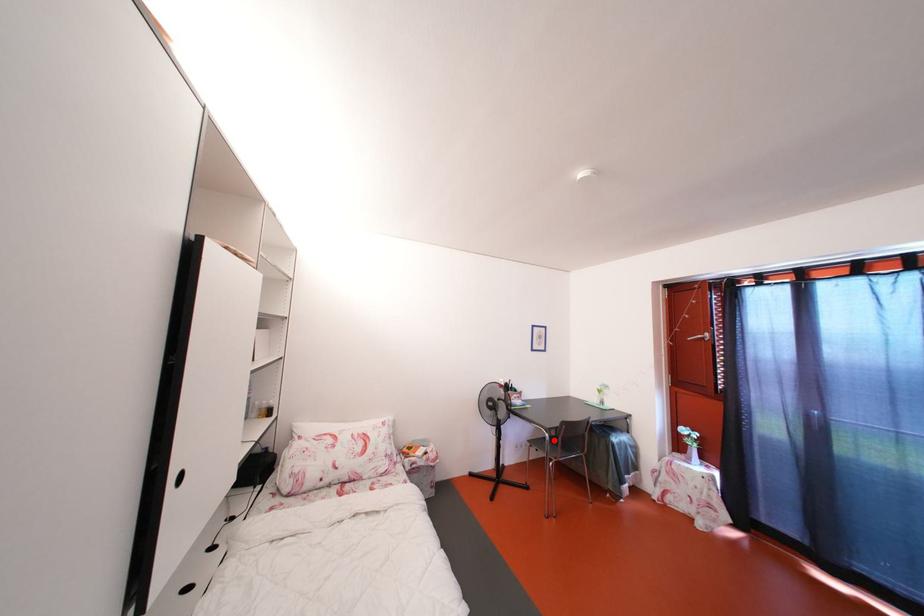
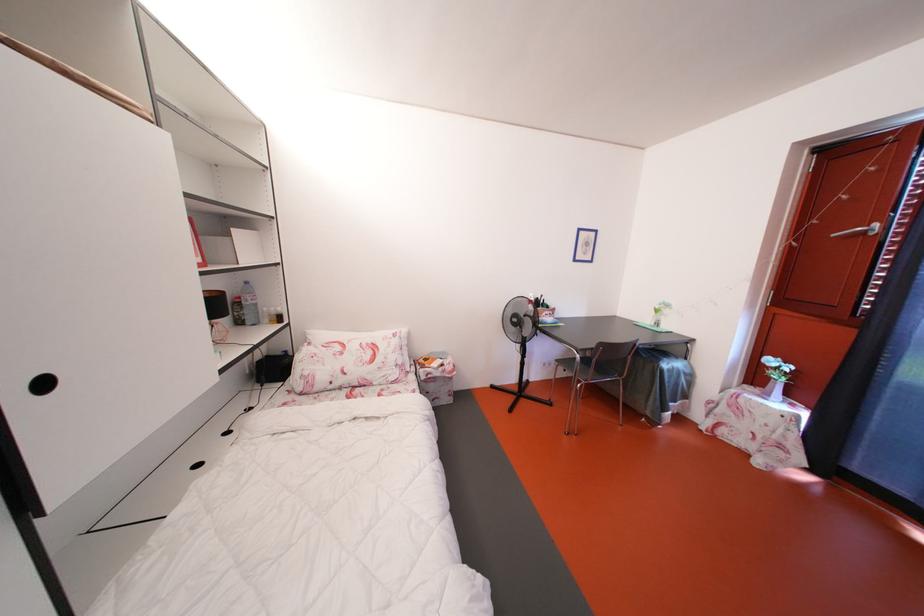
Question: I am providing you with two images of the same scene from different viewpoints. Image1 has a red point marked. In image2, the corresponding 3D location appears at what relative position? Reply with the corresponding letter.

Choices:
 (A) Closer
 (B) Farther

Answer: (A)